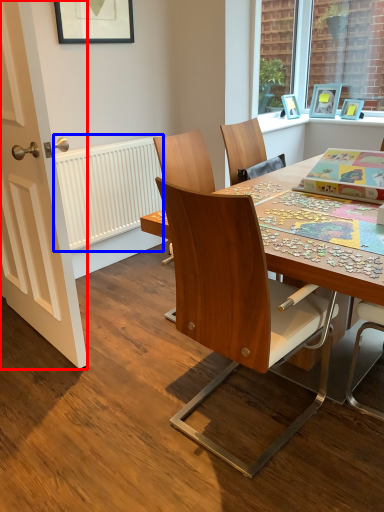
Question: Among these objects, which one is farthest to the camera, door (highlighted by a red box) or radiator (highlighted by a blue box)?

Choices:
 (A) door
 (B) radiator

Answer: (B)